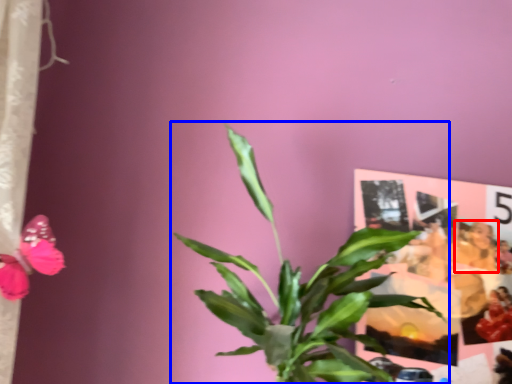
Question: Which object is further to the camera taking this photo, person (highlighted by a red box) or houseplant (highlighted by a blue box)?

Choices:
 (A) person
 (B) houseplant

Answer: (A)